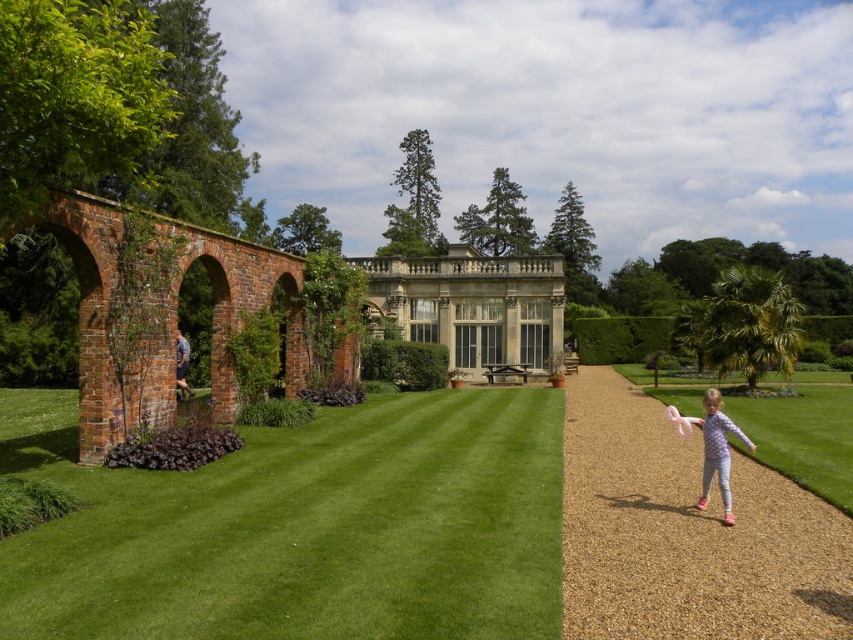
Between purple printed pajamas at right and dark blue jeans at left, which one has more height?

purple printed pajamas at right

Between point (726, 488) and point (183, 392), which one is positioned in front?

Point (726, 488) is in front.

The image size is (853, 640). Find the location of `purple printed pajamas at right`. purple printed pajamas at right is located at coordinates (712, 448).

Can you confirm if light green grass at lower right is taller than dark blue jeans at left?

In fact, light green grass at lower right may be shorter than dark blue jeans at left.

Where is `light green grass at lower right`? The image size is (853, 640). light green grass at lower right is located at coordinates (x=802, y=436).

From the picture: Can you confirm if green grass at center is bigger than brown gravel path at center?

Indeed, green grass at center has a larger size compared to brown gravel path at center.

Consider the image. Who is more forward, (389, 637) or (660, 490)?

Point (389, 637) is in front.

Who is more forward, [311,637] or [613,630]?

Positioned in front is point [311,637].

I want to click on green grass at center, so click(300, 528).